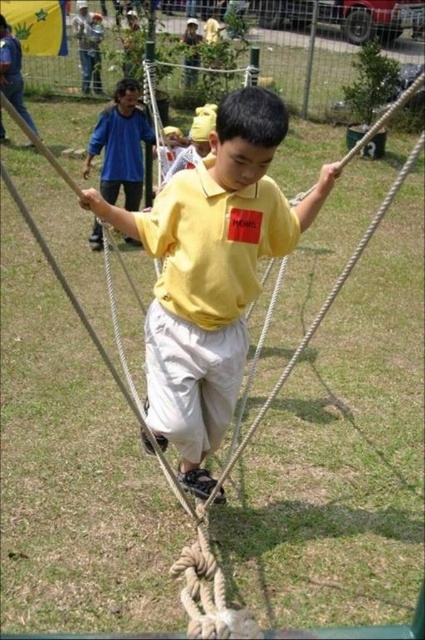
The width and height of the screenshot is (425, 640). What do you see at coordinates (212, 273) in the screenshot?
I see `yellow matte shirt at center` at bounding box center [212, 273].

Who is positioned more to the left, yellow matte shirt at center or blue cotton shirt at upper left?

blue cotton shirt at upper left is more to the left.

The width and height of the screenshot is (425, 640). Find the location of `yellow matte shirt at center`. yellow matte shirt at center is located at coordinates (212, 273).